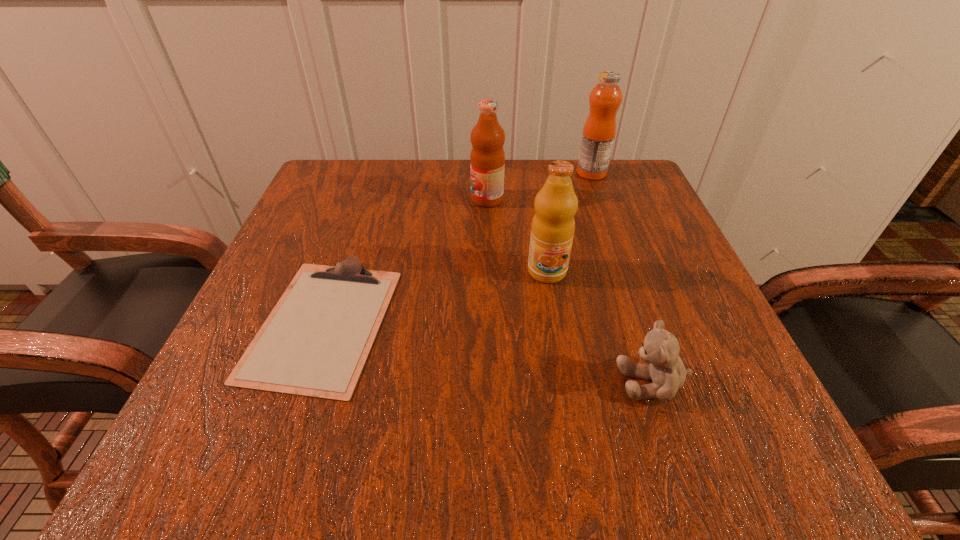
At what (x,y) coordinates should I click in order to perform the action: click on the farthest object. Please return your answer as a coordinate pair (x, y). Looking at the image, I should click on (599, 130).

Locate an element on the screen. Image resolution: width=960 pixels, height=540 pixels. the farthest fruit juice is located at coordinates (599, 130).

This screenshot has width=960, height=540. What are the coordinates of `the second farthest object` in the screenshot? It's located at (487, 158).

This screenshot has width=960, height=540. I want to click on the fourth object from right to left, so click(487, 158).

Locate an element on the screen. The height and width of the screenshot is (540, 960). the nearest fruit juice is located at coordinates (553, 225).

Find the location of a particular element. The height and width of the screenshot is (540, 960). the second fruit juice from left to right is located at coordinates (553, 225).

The height and width of the screenshot is (540, 960). I want to click on the fourth tallest object, so click(x=660, y=348).

In order to click on the shortest object in this screenshot , I will do `click(315, 342)`.

You are a GUI agent. You are given a task and a screenshot of the screen. Output one action in this format:
    pyautogui.click(x=<x>, y=<y>)
    Task: Click on the clipboard
    The width and height of the screenshot is (960, 540).
    Given the screenshot: What is the action you would take?
    pyautogui.click(x=315, y=342)

This screenshot has width=960, height=540. I want to click on free space located 0.100m on the left of the farthest fruit juice, so click(x=535, y=173).